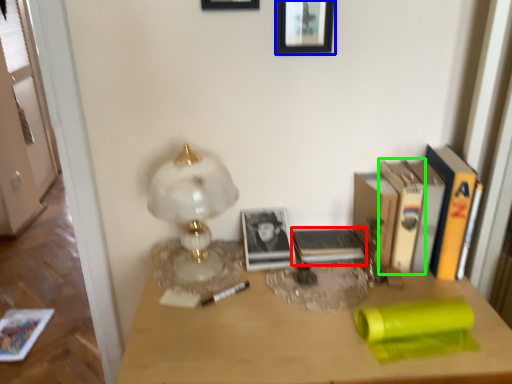
Question: Which object is the farthest from paperback book (highlighted by a red box)? Choose among these: picture frame (highlighted by a blue box) or paperback book (highlighted by a green box).

Choices:
 (A) picture frame
 (B) paperback book

Answer: (A)